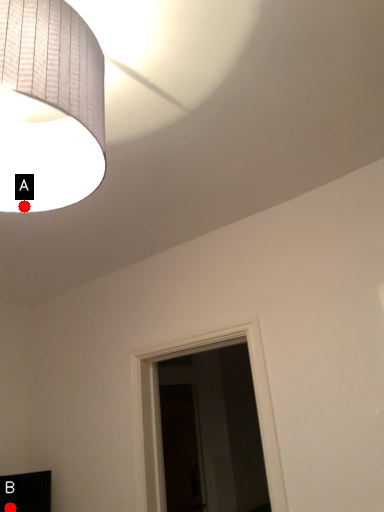
Question: Two points are circled on the image, labeled by A and B beside each circle. Which point is farther to the camera?

Choices:
 (A) A is further
 (B) B is further

Answer: (B)